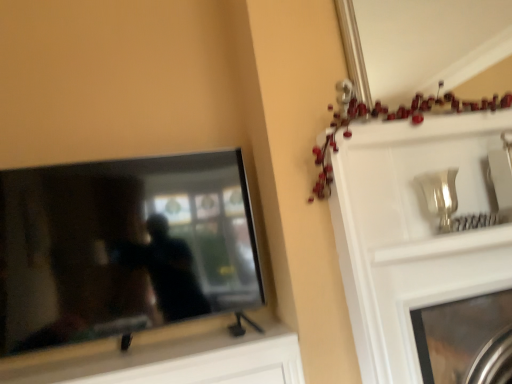
Question: Is metallic garland at upper right at the back of metallic silver fireplace at upper right?

Choices:
 (A) no
 (B) yes

Answer: (A)

Question: Would you say metallic garland at upper right is part of metallic silver fireplace at upper right's contents?

Choices:
 (A) yes
 (B) no

Answer: (B)

Question: Is the position of metallic silver fireplace at upper right more distant than that of metallic garland at upper right?

Choices:
 (A) yes
 (B) no

Answer: (A)

Question: Does metallic silver fireplace at upper right have a greater width compared to metallic garland at upper right?

Choices:
 (A) yes
 (B) no

Answer: (A)

Question: Can you confirm if metallic silver fireplace at upper right is positioned to the right of metallic garland at upper right?

Choices:
 (A) no
 (B) yes

Answer: (B)

Question: Considering the relative sizes of metallic silver fireplace at upper right and metallic garland at upper right in the image provided, is metallic silver fireplace at upper right thinner than metallic garland at upper right?

Choices:
 (A) yes
 (B) no

Answer: (B)

Question: Is matte black tv at left facing towards metallic silver mirror at upper center?

Choices:
 (A) no
 (B) yes

Answer: (A)

Question: Considering the relative sizes of matte black tv at left and metallic silver mirror at upper center in the image provided, is matte black tv at left bigger than metallic silver mirror at upper center?

Choices:
 (A) no
 (B) yes

Answer: (B)

Question: Is metallic silver mirror at upper center at the back of matte black tv at left?

Choices:
 (A) yes
 (B) no

Answer: (B)

Question: Is metallic silver mirror at upper center inside matte black tv at left?

Choices:
 (A) yes
 (B) no

Answer: (B)

Question: From a real-world perspective, does matte black tv at left stand above metallic silver mirror at upper center?

Choices:
 (A) no
 (B) yes

Answer: (A)

Question: Can you confirm if matte black tv at left is shorter than metallic silver mirror at upper center?

Choices:
 (A) no
 (B) yes

Answer: (A)

Question: Is metallic silver mirror at upper center shorter than metallic silver fireplace at upper right?

Choices:
 (A) no
 (B) yes

Answer: (B)